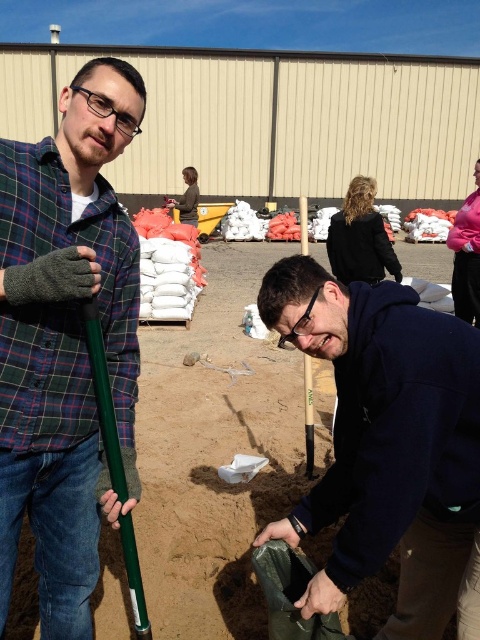
Question: Which object appears closest to the camera in this image?

Choices:
 (A) dark blue hoodie at center
 (B) green plastic shovel at left

Answer: (B)

Question: Is green plastic shovel at left positioned in front of dark blue hoodie at center?

Choices:
 (A) yes
 (B) no

Answer: (A)

Question: Can you confirm if brown sandy dirt at center is thinner than dark blue hoodie at center?

Choices:
 (A) no
 (B) yes

Answer: (A)

Question: Which point appears closest to the camera in this image?

Choices:
 (A) (395, 387)
 (B) (108, 136)
 (C) (233, 323)

Answer: (A)

Question: Based on their relative distances, which object is nearer to the green plastic shovel at left?

Choices:
 (A) dark blue hoodie at center
 (B) brown sandy dirt at center

Answer: (A)

Question: Is green plastic shovel at left bigger than dark blue hoodie at center?

Choices:
 (A) no
 (B) yes

Answer: (B)